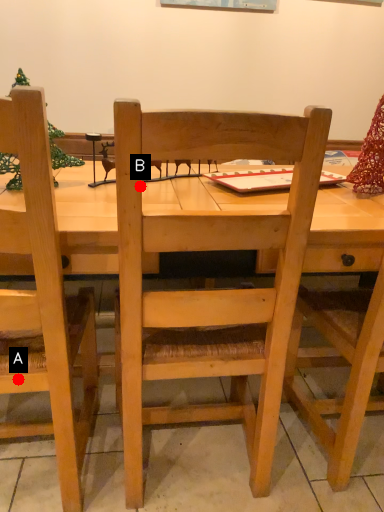
Question: Two points are circled on the image, labeled by A and B beside each circle. Which point is farther from the camera taking this photo?

Choices:
 (A) A is further
 (B) B is further

Answer: (A)